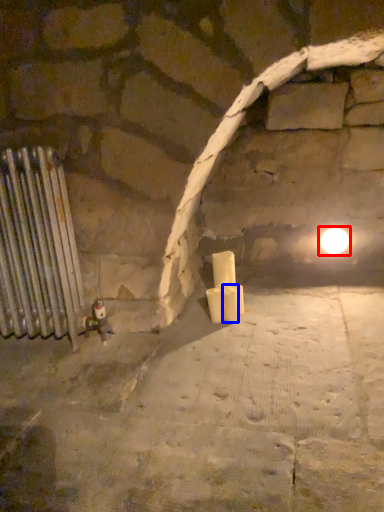
Question: Which object is further to the camera taking this photo, light (highlighted by a red box) or candle (highlighted by a blue box)?

Choices:
 (A) light
 (B) candle

Answer: (A)